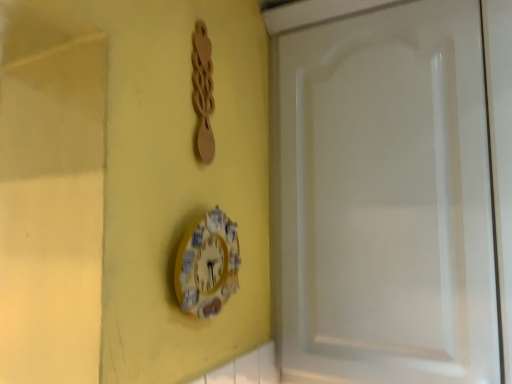
Question: Is yellow painted wood clock at center surrounding white glossy cabinet door at right?

Choices:
 (A) yes
 (B) no

Answer: (B)

Question: Considering the relative sizes of yellow painted wood clock at center and white glossy cabinet door at right in the image provided, is yellow painted wood clock at center thinner than white glossy cabinet door at right?

Choices:
 (A) yes
 (B) no

Answer: (A)

Question: From the image's perspective, is yellow painted wood clock at center beneath white glossy cabinet door at right?

Choices:
 (A) yes
 (B) no

Answer: (A)

Question: Is yellow painted wood clock at center at the right side of white glossy cabinet door at right?

Choices:
 (A) yes
 (B) no

Answer: (B)

Question: Is yellow painted wood clock at center positioned with its back to white glossy cabinet door at right?

Choices:
 (A) no
 (B) yes

Answer: (A)

Question: From a real-world perspective, is yellow painted wood clock at center physically below white glossy cabinet door at right?

Choices:
 (A) no
 (B) yes

Answer: (B)

Question: Is white glossy cabinet door at right outside of yellow painted wood clock at center?

Choices:
 (A) no
 (B) yes

Answer: (B)

Question: Is white glossy cabinet door at right at the right side of yellow painted wood clock at center?

Choices:
 (A) no
 (B) yes

Answer: (B)

Question: Does white glossy cabinet door at right have a smaller size compared to yellow painted wood clock at center?

Choices:
 (A) no
 (B) yes

Answer: (A)

Question: Is white glossy cabinet door at right shorter than yellow painted wood clock at center?

Choices:
 (A) yes
 (B) no

Answer: (B)

Question: Does white glossy cabinet door at right have a lesser width compared to yellow painted wood clock at center?

Choices:
 (A) yes
 (B) no

Answer: (B)

Question: Can you confirm if white glossy cabinet door at right is wider than yellow painted wood clock at center?

Choices:
 (A) yes
 (B) no

Answer: (A)

Question: In terms of width, does yellow painted wood clock at center look wider or thinner when compared to white glossy cabinet door at right?

Choices:
 (A) thin
 (B) wide

Answer: (A)